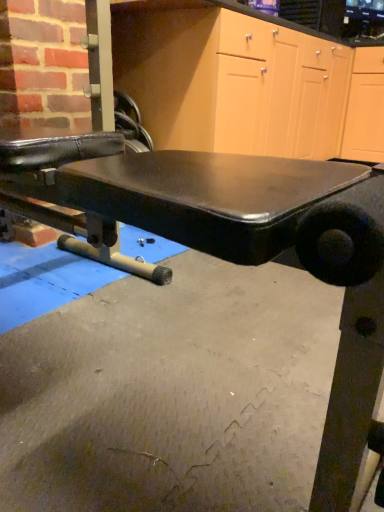
Measure the distance between point [368,135] and camera.

2.94 meters.

At what (x,y) coordinates should I click in order to perform the action: click on matte wood cabinet at upper right. Please return your answer as a coordinate pair (x, y). Image resolution: width=384 pixels, height=512 pixels. Looking at the image, I should click on tap(365, 106).

Image resolution: width=384 pixels, height=512 pixels. What do you see at coordinates (365, 106) in the screenshot? I see `matte wood cabinet at upper right` at bounding box center [365, 106].

Where is `matte wood cabinet at upper right`? matte wood cabinet at upper right is located at coordinates (365, 106).